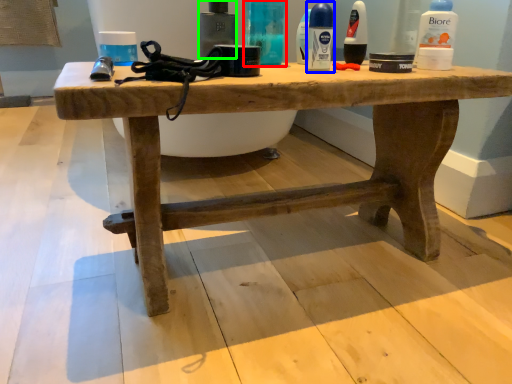
Question: Estimate the real-world distances between objects in this image. Which object is farther from toiletry (highlighted by a red box), mouthwash (highlighted by a blue box) or toiletry (highlighted by a green box)?

Choices:
 (A) mouthwash
 (B) toiletry

Answer: (A)